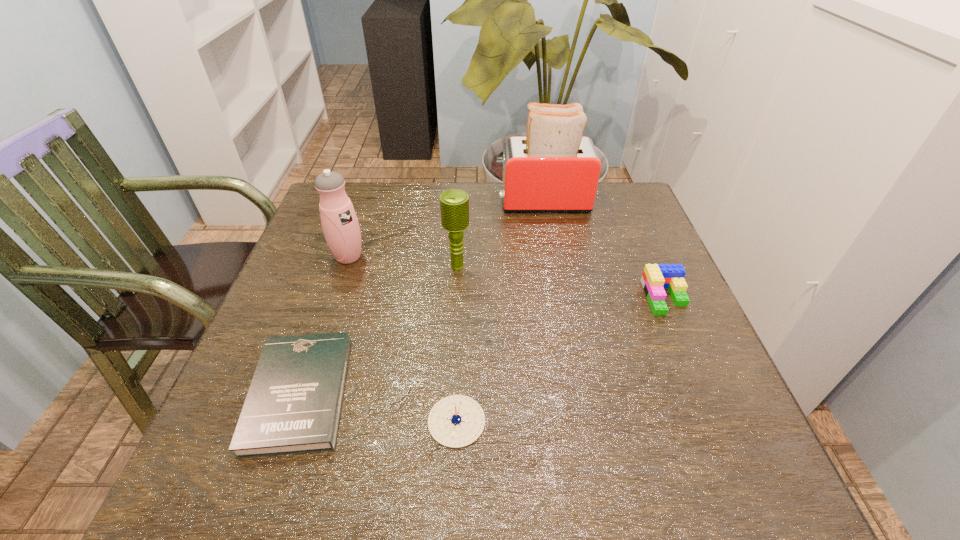
Locate an element on the screen. Image resolution: width=960 pixels, height=540 pixels. vacant point at the near right corner is located at coordinates point(683,467).

Image resolution: width=960 pixels, height=540 pixels. In order to click on blank region between the Lego and the thermos bottle in this screenshot , I will do `click(507, 277)`.

Find the location of `unoccupied position between the compass and the Lego`. unoccupied position between the compass and the Lego is located at coordinates click(561, 359).

I want to click on empty space that is in between the thermos bottle and the Lego, so point(507,277).

Locate an element on the screen. The height and width of the screenshot is (540, 960). free space between the second object from right to left and the compass is located at coordinates (499, 311).

Where is `free space between the shortest object and the compass`? The width and height of the screenshot is (960, 540). free space between the shortest object and the compass is located at coordinates (378, 408).

Find the location of a particular element. vacant area that lies between the farthest object and the shortest object is located at coordinates (420, 298).

This screenshot has height=540, width=960. I want to click on free space between the thermos bottle and the rightmost object, so click(507, 277).

You are a GUI agent. You are given a task and a screenshot of the screen. Output one action in this format:
    pyautogui.click(x=<x>, y=<y>)
    Task: Click on the blank region between the shortest object and the compass
    This screenshot has width=960, height=540.
    Given the screenshot: What is the action you would take?
    pyautogui.click(x=378, y=408)

Find the location of `free spot between the thermos bottle and the shortest object`. free spot between the thermos bottle and the shortest object is located at coordinates (324, 325).